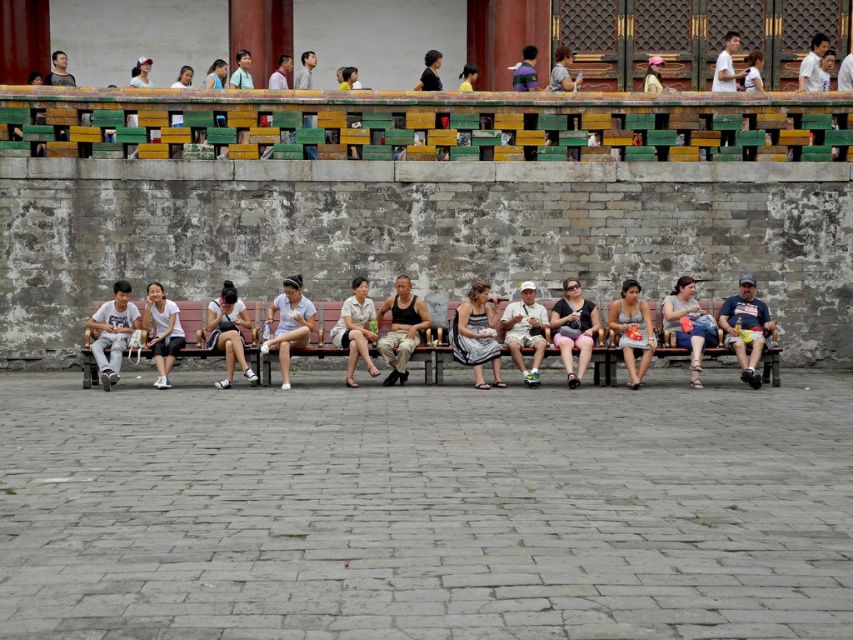
Question: Which of these objects is positioned farthest from the matte black shirt at center?

Choices:
 (A) light gray cotton pants at left
 (B) light blue denim jeans at center
 (C) striped fabric dress at center

Answer: (A)

Question: Which object appears farthest from the camera in this image?

Choices:
 (A) striped fabric dress at center
 (B) black matte tank top at center
 (C) light gray cotton pants at left
 (D) light blue denim jeans at center

Answer: (B)

Question: Can you confirm if white matte shorts at center is positioned above matte white shirt at center?

Choices:
 (A) no
 (B) yes

Answer: (B)

Question: In this image, where is striped fabric dress at center located relative to silver metallic dress at center?

Choices:
 (A) above
 (B) below

Answer: (B)

Question: Which point is farther to the camera?

Choices:
 (A) (636, 333)
 (B) (491, 339)
 (C) (534, 352)

Answer: (A)

Question: Is white matte shorts at center positioned before light beige shorts at center?

Choices:
 (A) no
 (B) yes

Answer: (B)